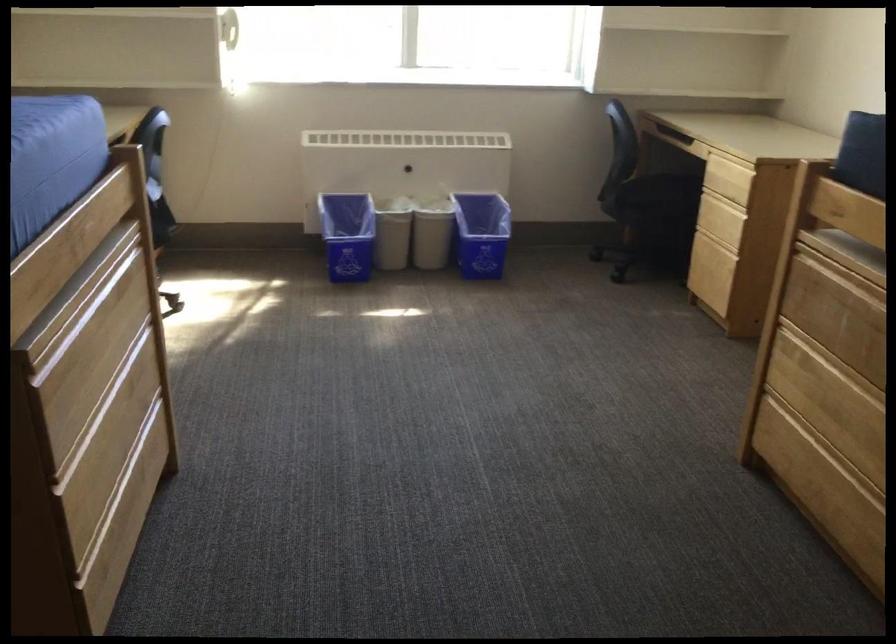
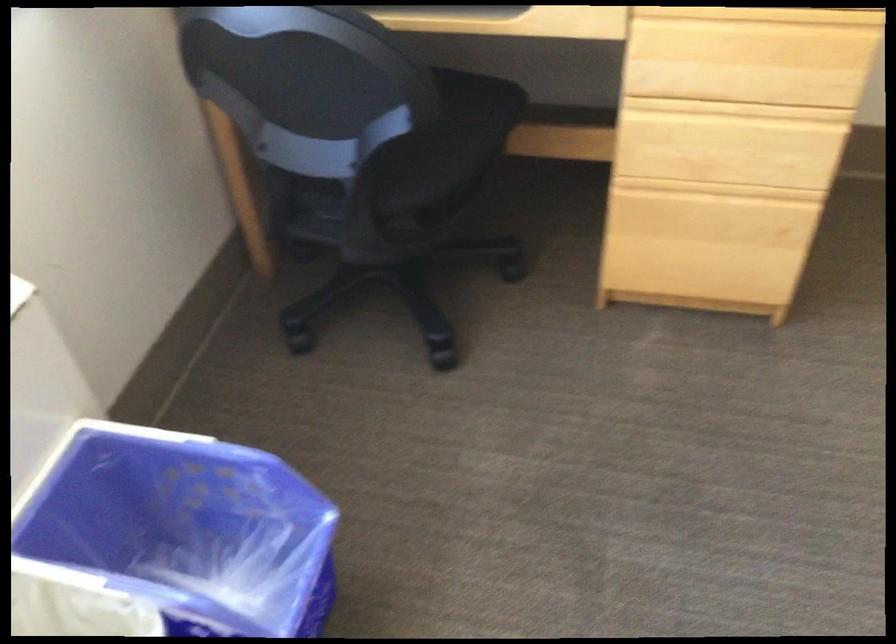
In the second image, find the point that corresponds to [728,149] in the first image.

(768, 15)